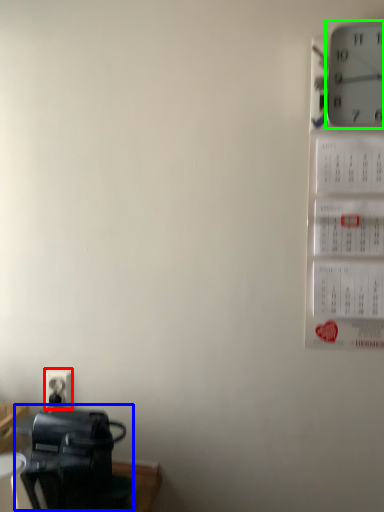
Question: Which object is positioned closest to electric outlet (highlighted by a red box)? Select from appliance (highlighted by a blue box) and wall clock (highlighted by a green box).

Choices:
 (A) appliance
 (B) wall clock

Answer: (A)